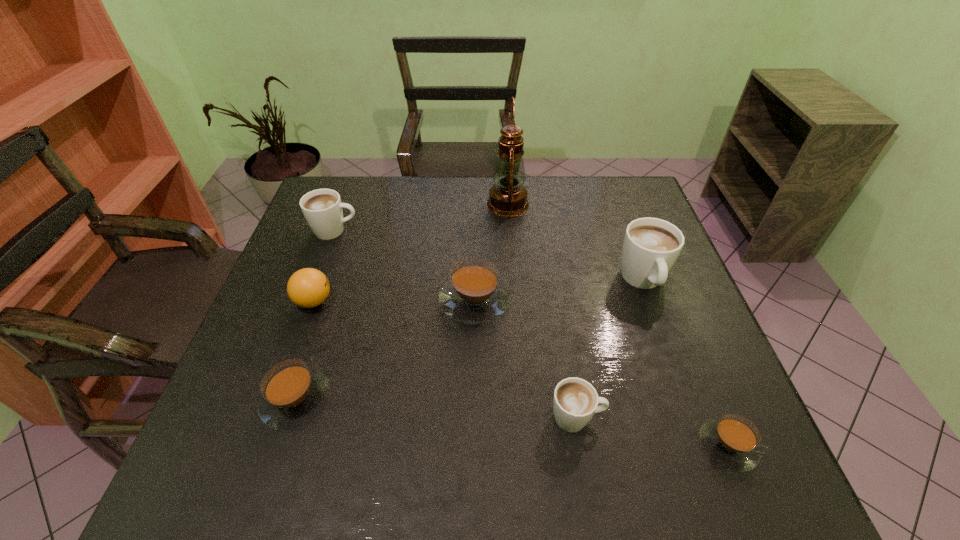
This screenshot has height=540, width=960. In order to click on the tallest object in this screenshot , I will do `click(508, 196)`.

This screenshot has height=540, width=960. In order to click on the tallest cappuccino in this screenshot , I will do `click(651, 246)`.

Locate an element on the screen. This screenshot has width=960, height=540. the biggest white cappuccino is located at coordinates (651, 246).

At what (x,y) coordinates should I click in order to perform the action: click on the second biggest white cappuccino. Please return your answer as a coordinate pair (x, y). Image resolution: width=960 pixels, height=540 pixels. Looking at the image, I should click on (x=323, y=210).

Locate an element on the screen. This screenshot has height=540, width=960. the leftmost white cappuccino is located at coordinates (323, 210).

Image resolution: width=960 pixels, height=540 pixels. Find the location of `ping-pong ball`. ping-pong ball is located at coordinates (308, 287).

At what (x,y) coordinates should I click in order to perform the action: click on the second brown cappuccino from left to right. Please return your answer as a coordinate pair (x, y). The image size is (960, 540). Looking at the image, I should click on (474, 294).

The width and height of the screenshot is (960, 540). Identify the location of the fourth cappuccino from right to left. (474, 294).

You are a GUI agent. You are given a task and a screenshot of the screen. Output one action in this format:
    pyautogui.click(x=<x>, y=<y>)
    Task: Click on the second white cappuccino from right to left
    The height and width of the screenshot is (540, 960).
    Given the screenshot: What is the action you would take?
    pyautogui.click(x=575, y=401)

Identify the location of the fourth cappuccino from left to right. The width and height of the screenshot is (960, 540). (575, 401).